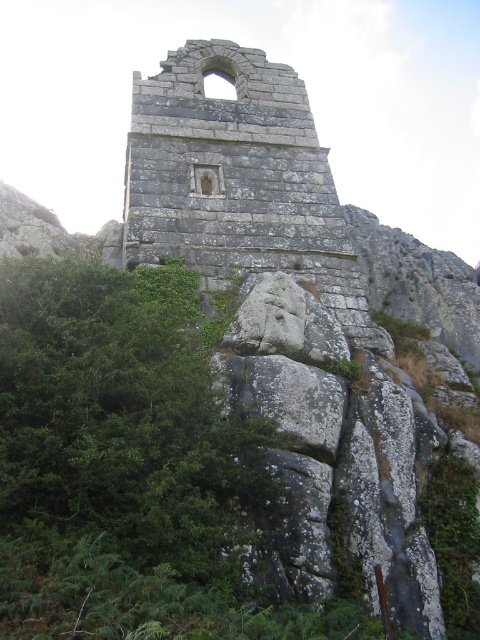
You are a hiker who has reached the gray stone ruins at center and notices the green leafy shrub at center. Which object is positioned higher in elevation?

The gray stone ruins at center is above the green leafy shrub at center, so the gray stone ruins at center is positioned higher in elevation.

You are a hiker trying to navigate through the dense green leafy shrub at center. You notice the gray stone ruins at center nearby. Which object is larger in size between the two?

The gray stone ruins at center is bigger than the green leafy shrub at center.